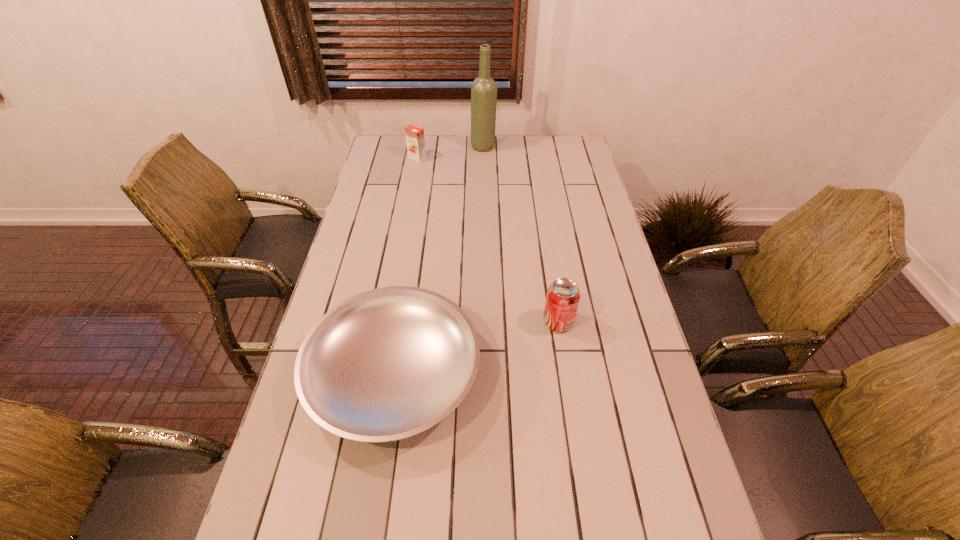
Find the location of a particular element. This screenshot has width=960, height=540. orange juice at the left edge is located at coordinates (415, 140).

Where is `bedpan present at the left edge`? This screenshot has width=960, height=540. bedpan present at the left edge is located at coordinates (386, 364).

Image resolution: width=960 pixels, height=540 pixels. I want to click on object located at the far left corner, so click(415, 140).

In the image, there is a desktop. Where is `free region at the far edge`? free region at the far edge is located at coordinates (444, 156).

Locate an element on the screen. This screenshot has width=960, height=540. vacant area at the left edge is located at coordinates (378, 165).

In the image, there is a desktop. At what (x,y) coordinates should I click in order to perform the action: click on blank space at the right edge. Please return your answer as a coordinate pair (x, y). The height and width of the screenshot is (540, 960). Looking at the image, I should click on (618, 265).

Identify the location of vacant space at the far left corner of the desktop. (400, 136).

The image size is (960, 540). What are the coordinates of `vacant space that's between the orange juice and the soda can` in the screenshot? It's located at (488, 240).

Locate an element on the screen. This screenshot has width=960, height=540. vacant space that is in between the orange juice and the tallest object is located at coordinates (450, 152).

Identify the location of vacant region between the tallest object and the shortest object. (439, 260).